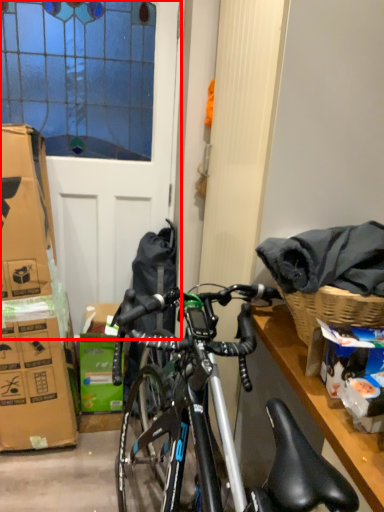
Question: Where is screen door (annotated by the red box) located in relation to box in the image?

Choices:
 (A) left
 (B) right

Answer: (A)